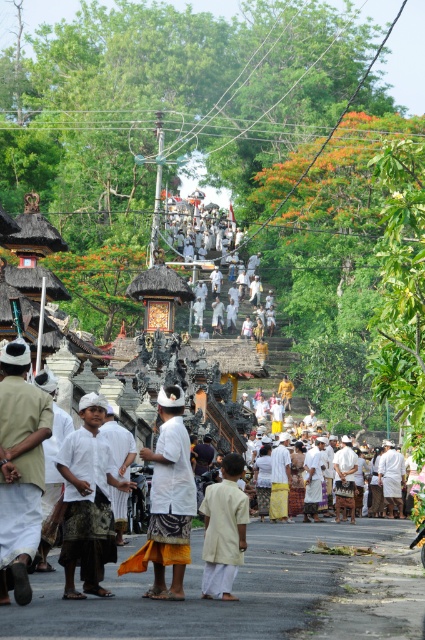
Between white woven cloth at center and light beige fabric at center, which one is positioned higher?

white woven cloth at center is above.

At what (x,y) coordinates should I click in order to perform the action: click on white woven cloth at center. Please return your answer as a coordinate pair (x, y). The height and width of the screenshot is (640, 425). Looking at the image, I should click on (87, 500).

What do you see at coordinates (87, 500) in the screenshot? The height and width of the screenshot is (640, 425). I see `white woven cloth at center` at bounding box center [87, 500].

I want to click on white woven cloth at center, so click(x=87, y=500).

In the scene shown: Does light beige cotton shirt at left have a lesser width compared to white woven cloth at center?

Indeed, light beige cotton shirt at left has a lesser width compared to white woven cloth at center.

The width and height of the screenshot is (425, 640). What are the coordinates of `light beige cotton shirt at left` in the screenshot? It's located at (19, 468).

Is point (5, 556) positioned in front of point (96, 595)?

Yes, point (5, 556) is closer to viewer.

I want to click on light beige cotton shirt at left, so click(x=19, y=468).

Is light beige cotton shirt at left to the left of light beige fabric at center from the viewer's perspective?

Yes, light beige cotton shirt at left is to the left of light beige fabric at center.

Between point (8, 342) and point (218, 525), which one is positioned behind?

Point (8, 342)

Looking at this image, who is more forward, (45, 406) or (207, 516)?

Point (45, 406) is in front.

Identify the location of light beige cotton shirt at left. (19, 468).